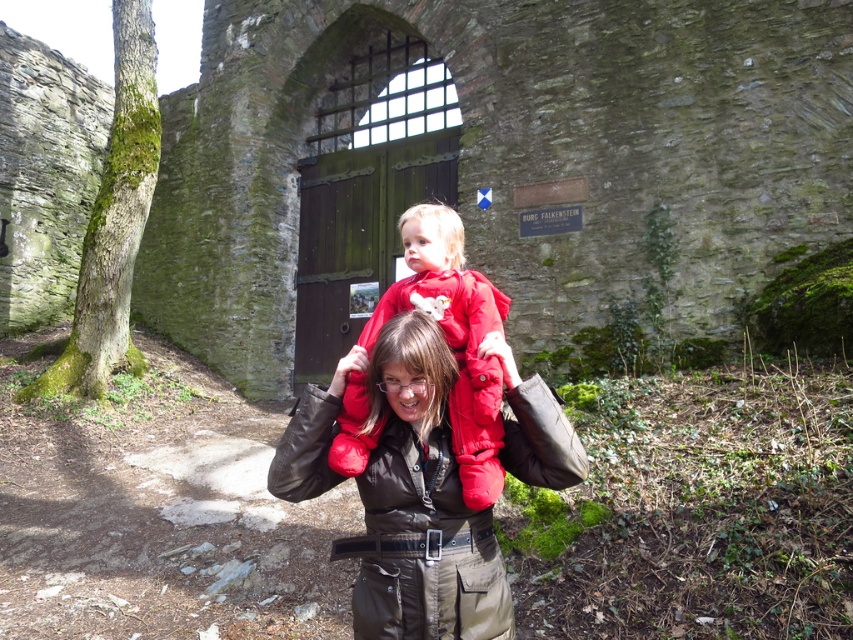
Measure the distance between point (407,493) and camera.

Point (407,493) and camera are 3.03 meters apart.

Does point (463, 531) lie behind point (398, 228)?

No.

Looking at this image, who is more distant from viewer, (396,323) or (463,336)?

The point (463,336) is more distant.

Identify the location of brown leather jacket at center. The image size is (853, 640). pyautogui.click(x=421, y=508).